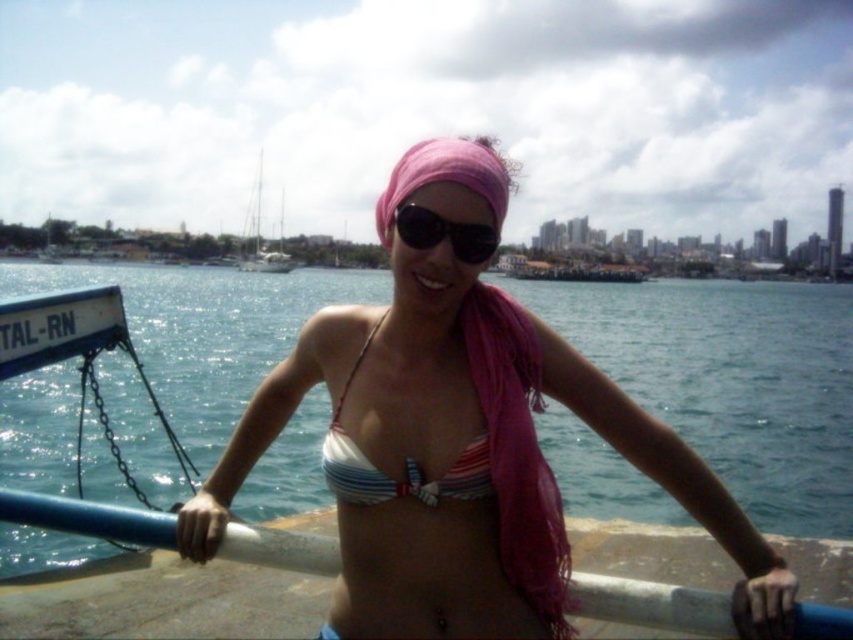
You are a GUI agent. You are given a task and a screenshot of the screen. Output one action in this format:
    pyautogui.click(x=<x>, y=<y>)
    Task: Click on the striped fabric bikini top at center
    This screenshot has width=853, height=640.
    Given the screenshot: What is the action you would take?
    pyautogui.click(x=404, y=464)

Is striped fabric bikini top at center bigger than black reflective sunglasses at center?

No, striped fabric bikini top at center is not bigger than black reflective sunglasses at center.

At what (x,y) coordinates should I click in order to perform the action: click on striped fabric bikini top at center. Please return your answer as a coordinate pair (x, y). Looking at the image, I should click on (404, 464).

Consider the image. Measure the distance from striped fabric bikini top at center to pink fabric headscarf at center.

A distance of 8.36 meters exists between striped fabric bikini top at center and pink fabric headscarf at center.

Can you confirm if striped fabric bikini top at center is taller than pink fabric headscarf at center?

No, striped fabric bikini top at center is not taller than pink fabric headscarf at center.

Which is in front, point (326, 452) or point (480, 168)?

Point (480, 168)

Find the location of `striped fabric bikini top at center`. striped fabric bikini top at center is located at coordinates (404, 464).

Which is more to the left, pink fabric headscarf at center or white matte sailboat at upper center?

white matte sailboat at upper center is more to the left.

Does pink fabric headscarf at center have a smaller size compared to white matte sailboat at upper center?

Correct, pink fabric headscarf at center occupies less space than white matte sailboat at upper center.

Is point (495, 164) positioned in front of point (253, 195)?

Yes, point (495, 164) is in front of point (253, 195).

Image resolution: width=853 pixels, height=640 pixels. What are the coordinates of `pink fabric headscarf at center` in the screenshot? It's located at tap(445, 177).